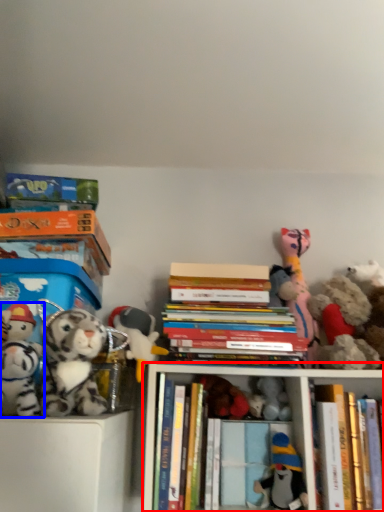
Question: Which object appears farthest to the camera in this image, shelf (highlighted by a red box) or toy (highlighted by a blue box)?

Choices:
 (A) shelf
 (B) toy

Answer: (A)